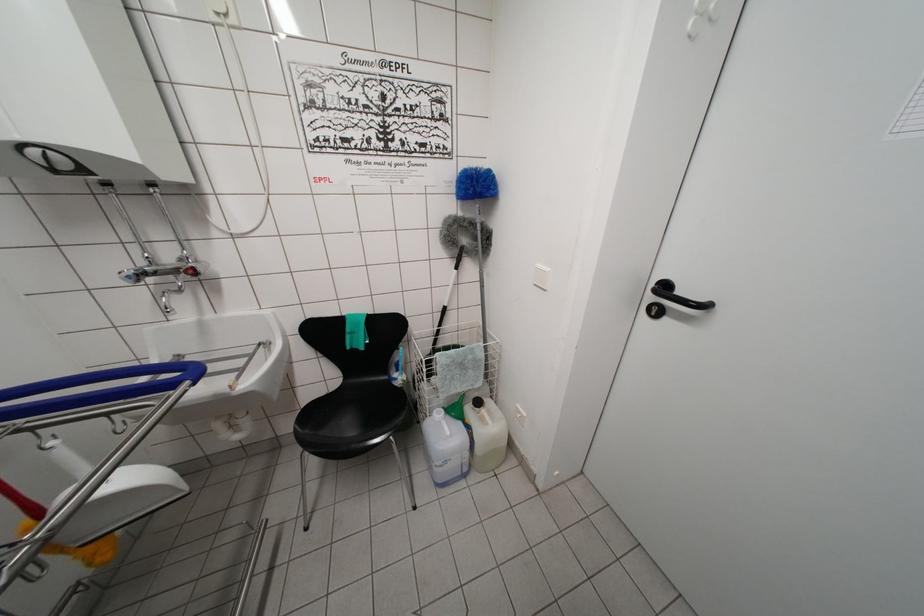
Where is `chair sitting surface`? This screenshot has height=616, width=924. chair sitting surface is located at coordinates (359, 410).